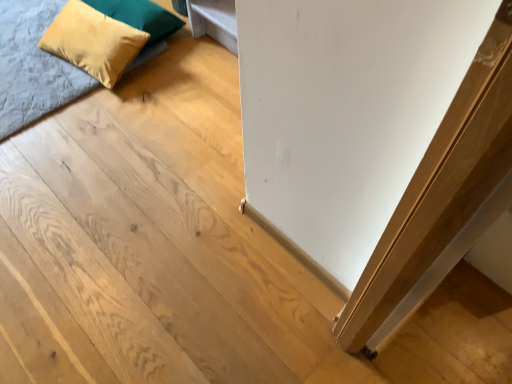
Question: Considering the positions of suede yellow pillow at upper left, the 1th pillow viewed from the top, and velvet yellow pillow at upper left, the 2th pillow from the top, in the image, is suede yellow pillow at upper left, the 1th pillow viewed from the top, taller or shorter than velvet yellow pillow at upper left, the 2th pillow from the top,?

Choices:
 (A) short
 (B) tall

Answer: (A)

Question: Considering the positions of point (132, 1) and point (80, 29), is point (132, 1) closer or farther from the camera than point (80, 29)?

Choices:
 (A) closer
 (B) farther

Answer: (B)

Question: Which object is positioned farthest from the velvet yellow pillow at upper left, which is counted as the first pillow, starting from the bottom?

Choices:
 (A) velvet blue bed at upper left
 (B) suede yellow pillow at upper left, which appears as the second pillow when ordered from the bottom

Answer: (A)

Question: Which object is positioned closest to the velvet yellow pillow at upper left, the 2th pillow from the top?

Choices:
 (A) suede yellow pillow at upper left, the 1th pillow viewed from the top
 (B) velvet blue bed at upper left

Answer: (A)